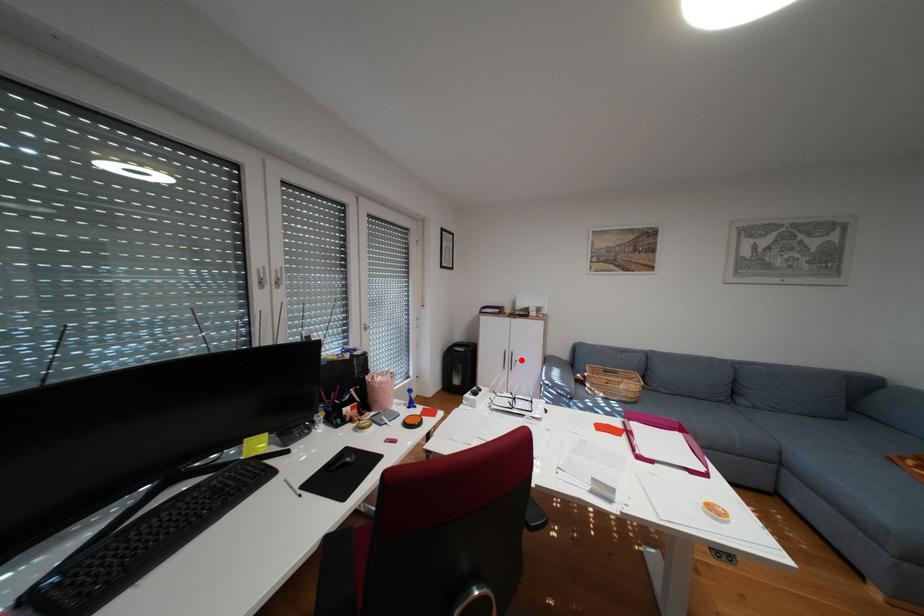
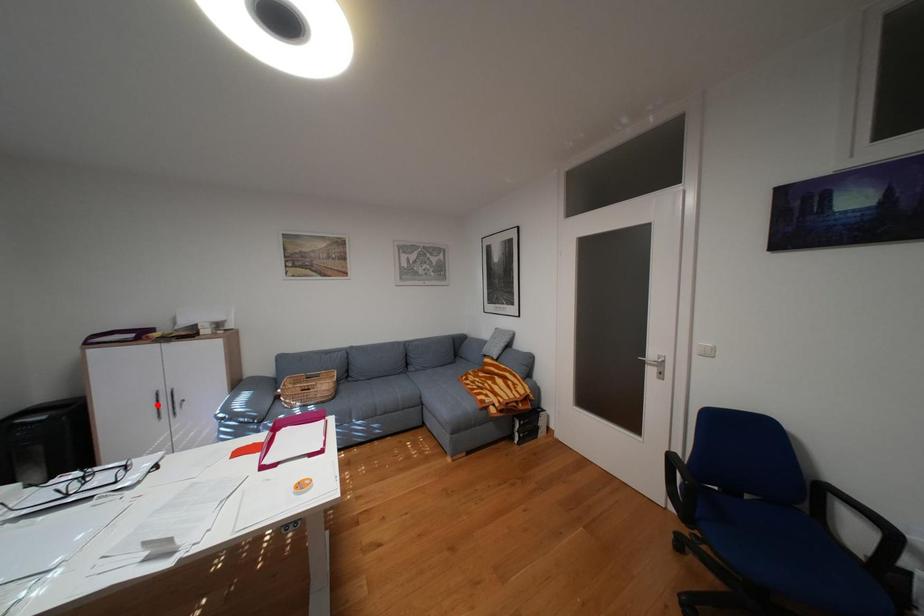
Looking at this image, I am providing you with two images of the same scene from different viewpoints. A red point is marked on the first image and another point is marked on the second image. Is the marked point in image1 the same physical position as the marked point in image2?

No